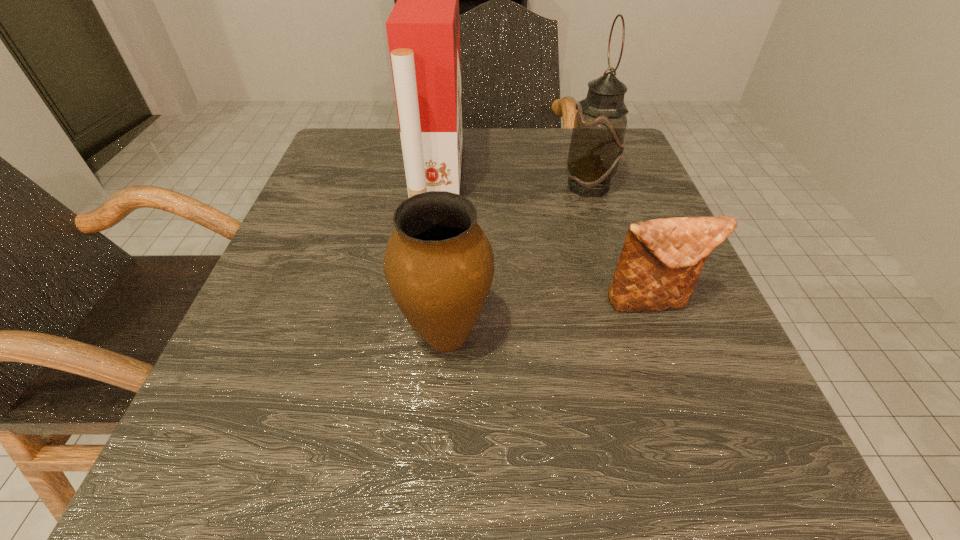
Image resolution: width=960 pixels, height=540 pixels. I want to click on oil lamp that is at the right edge, so click(x=597, y=143).

Where is `clutch bag at the right edge`? The image size is (960, 540). clutch bag at the right edge is located at coordinates (661, 260).

This screenshot has width=960, height=540. Find the location of `object positioned at the far right corner`. object positioned at the far right corner is located at coordinates (597, 143).

You are a GUI agent. You are given a task and a screenshot of the screen. Output one action in this format:
    pyautogui.click(x=<x>, y=<y>)
    Task: Click on the vacant space at the far edge
    Image resolution: width=960 pixels, height=540 pixels.
    Given the screenshot: What is the action you would take?
    pyautogui.click(x=528, y=136)

In the image, there is a desktop. Where is `free region at the near edge`? free region at the near edge is located at coordinates (334, 512).

At what (x,y) coordinates should I click in order to perform the action: click on vacant space at the left edge of the desktop. Please return your answer as a coordinate pair (x, y). This screenshot has height=540, width=960. Looking at the image, I should click on (284, 279).

Identify the location of vacant position at the right edge of the desktop. The width and height of the screenshot is (960, 540). (674, 314).

Find the location of a particular element. The height and width of the screenshot is (540, 960). vacant space at the far left corner of the desktop is located at coordinates (325, 160).

Locate an element on the screen. free space at the far right corner of the desktop is located at coordinates (620, 164).

The image size is (960, 540). I want to click on free location at the near right corner of the desktop, so 641,436.